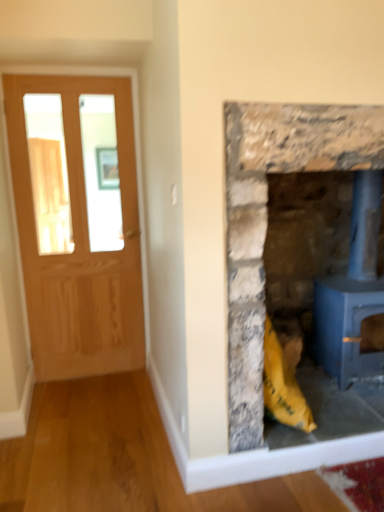
Question: Is rustic stone fireplace at right to the left of matte wooden door at left from the viewer's perspective?

Choices:
 (A) yes
 (B) no

Answer: (B)

Question: Does rustic stone fireplace at right lie in front of matte wooden door at left?

Choices:
 (A) yes
 (B) no

Answer: (A)

Question: Does rustic stone fireplace at right have a greater height compared to matte wooden door at left?

Choices:
 (A) yes
 (B) no

Answer: (B)

Question: Could matte wooden door at left be considered to be inside rustic stone fireplace at right?

Choices:
 (A) yes
 (B) no

Answer: (B)

Question: Is matte wooden door at left at the back of rustic stone fireplace at right?

Choices:
 (A) no
 (B) yes

Answer: (A)

Question: Is rustic stone fireplace at right inside the boundaries of blue painted metal wood burning stove at right, or outside?

Choices:
 (A) outside
 (B) inside

Answer: (A)

Question: In terms of width, does rustic stone fireplace at right look wider or thinner when compared to blue painted metal wood burning stove at right?

Choices:
 (A) thin
 (B) wide

Answer: (B)

Question: From a real-world perspective, is rustic stone fireplace at right physically located above or below blue painted metal wood burning stove at right?

Choices:
 (A) below
 (B) above

Answer: (B)

Question: In terms of height, does rustic stone fireplace at right look taller or shorter compared to blue painted metal wood burning stove at right?

Choices:
 (A) short
 (B) tall

Answer: (B)

Question: From a real-world perspective, is rustic stone fireplace at right above or below matte wooden door at left?

Choices:
 (A) below
 (B) above

Answer: (A)

Question: In the image, is rustic stone fireplace at right on the left side or the right side of matte wooden door at left?

Choices:
 (A) left
 (B) right

Answer: (B)

Question: Does point (317, 250) appear closer or farther from the camera than point (92, 361)?

Choices:
 (A) farther
 (B) closer

Answer: (B)

Question: From the image's perspective, is rustic stone fireplace at right above or below matte wooden door at left?

Choices:
 (A) below
 (B) above

Answer: (A)

Question: Is blue painted metal wood burning stove at right bigger or smaller than rustic stone fireplace at right?

Choices:
 (A) big
 (B) small

Answer: (B)

Question: Considering the positions of blue painted metal wood burning stove at right and rustic stone fireplace at right in the image, is blue painted metal wood burning stove at right taller or shorter than rustic stone fireplace at right?

Choices:
 (A) short
 (B) tall

Answer: (A)